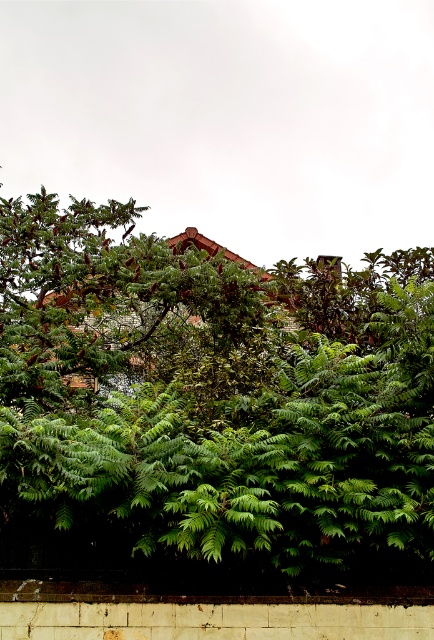
You are standing on the smooth concrete ledge at bottom and want to look up to see the top of the green leafy tree at center. Can you see the entire tree from your current position?

The green leafy tree at center is taller than the smooth concrete ledge at bottom, so you cannot see the entire tree from your current position on the smooth concrete ledge at bottom because the tree extends above your line of sight.

You are a gardener planning to place a small potted plant on the smooth concrete ledge at bottom. Considering the size of the green leafy tree at center, will the potted plant be visible from the front view?

The green leafy tree at center is larger than the smooth concrete ledge at bottom, so the small potted plant placed on the smooth concrete ledge at bottom may be partially or fully obscured by the tree, making it less visible from the front view.

Based on the coordinates provided, which object is located at point (x=210, y=401) in the image?

The point (x=210, y=401) marks the green leafy tree at center.